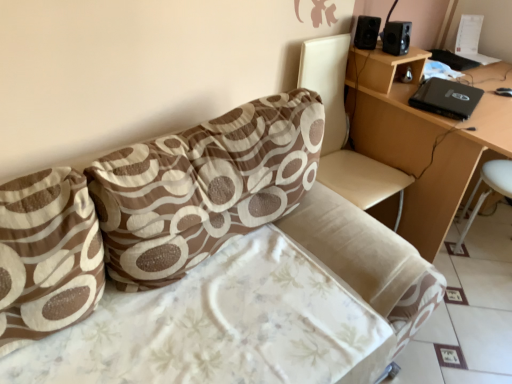
Find the location of a particular element. This screenshot has height=384, width=512. unoccupied region to the right of black plastic speaker at upper right, placed as the 2th speaker when sorted from left to right is located at coordinates (414, 54).